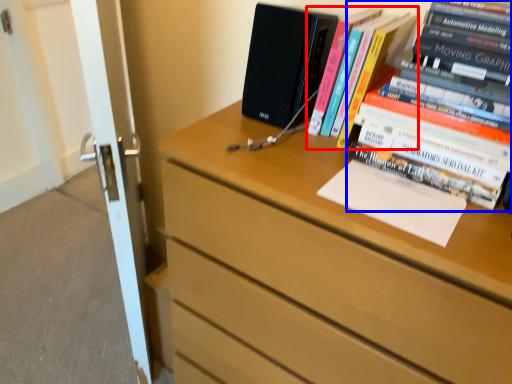
Question: Which object appears farthest to the camera in this image, book (highlighted by a red box) or book (highlighted by a blue box)?

Choices:
 (A) book
 (B) book

Answer: (A)